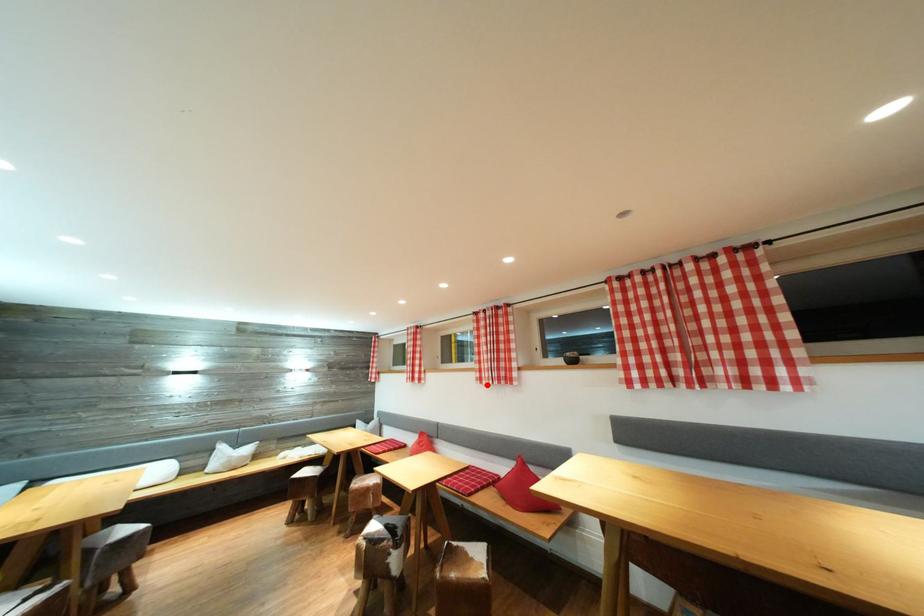
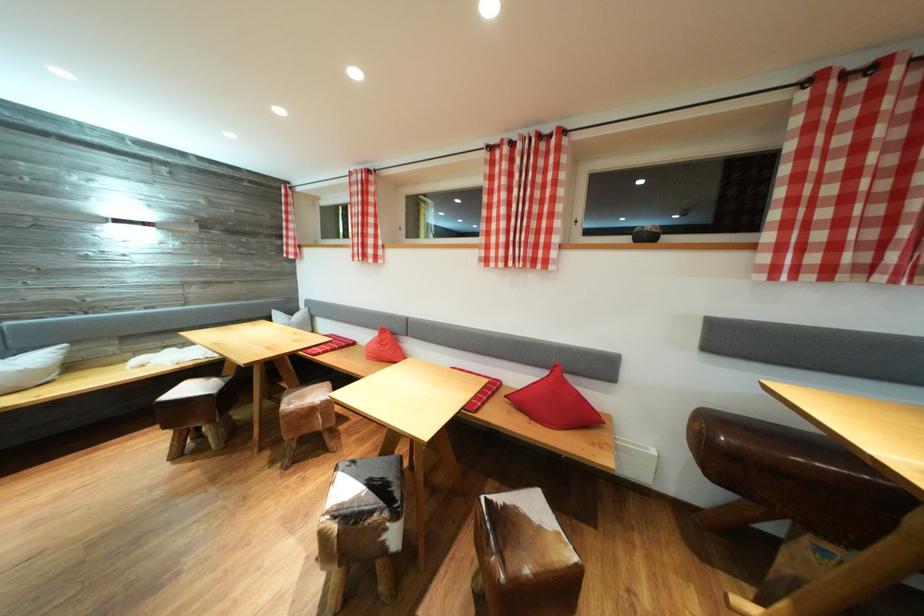
Question: I am providing you with two images of the same scene from different viewpoints. Given a red point in image1, look at the same physical point in image2. Is it:

Choices:
 (A) Closer to the viewpoint
 (B) Farther from the viewpoint

Answer: (A)